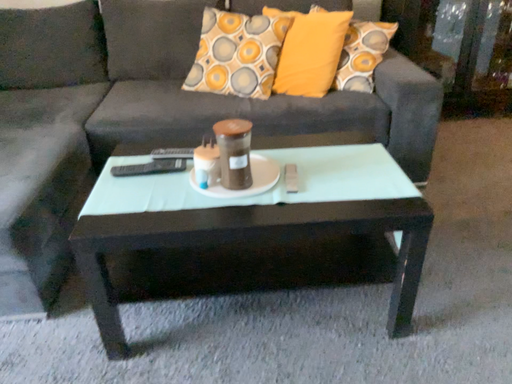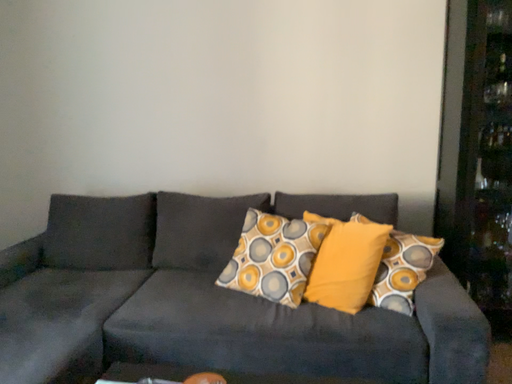
Question: Which way did the camera rotate in the video?

Choices:
 (A) rotated right
 (B) rotated left

Answer: (B)